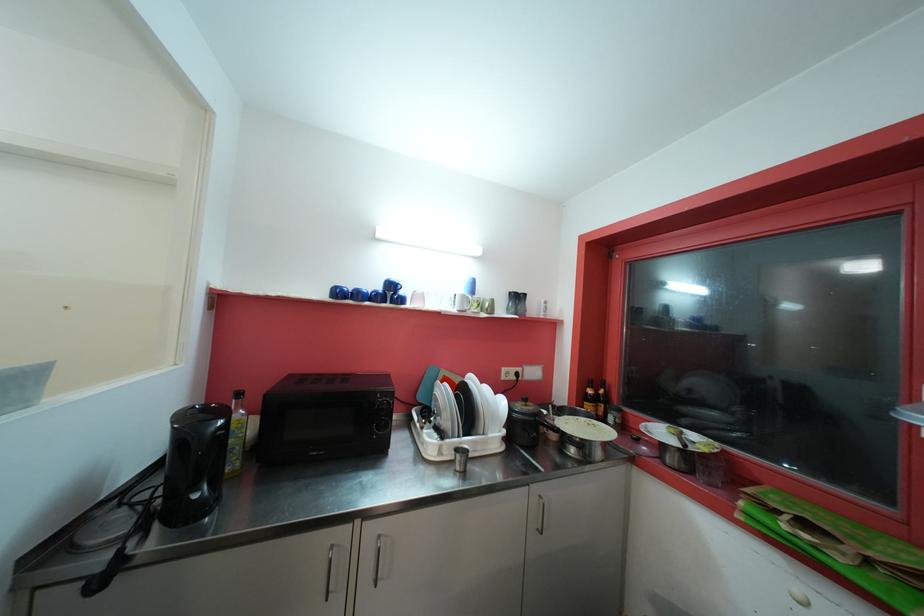
This screenshot has width=924, height=616. What are the coordinates of `black kettle handle` in the screenshot? It's located at (198, 475).